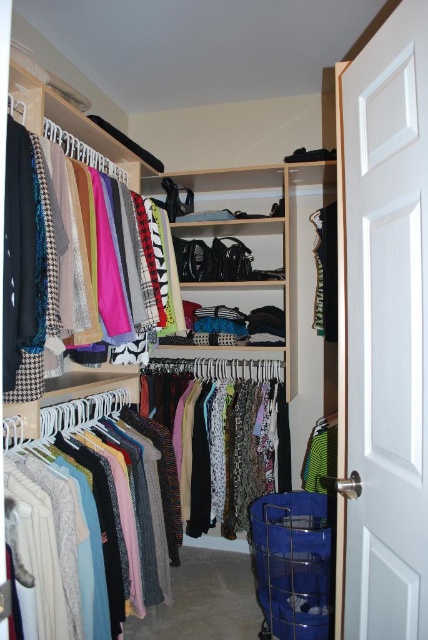
Is point (9, 300) closer to camera compared to point (324, 284)?

Yes, point (9, 300) is in front of point (324, 284).

Does matte black scarf at upper left appear on the left side of green jersey at center?

Correct, you'll find matte black scarf at upper left to the left of green jersey at center.

What do you see at coordinates (29, 266) in the screenshot?
I see `matte black scarf at upper left` at bounding box center [29, 266].

What are the coordinates of `matte black scarf at upper left` in the screenshot? It's located at (29, 266).

Does matte wooden closet at center have a lesser height compared to green jersey at center?

No, matte wooden closet at center is not shorter than green jersey at center.

Is point (288, 253) closer to camera compared to point (315, 225)?

Yes, point (288, 253) is in front of point (315, 225).

The image size is (428, 640). I want to click on matte wooden closet at center, so click(269, 218).

The width and height of the screenshot is (428, 640). What do you see at coordinates (59, 541) in the screenshot?
I see `knitwear at left` at bounding box center [59, 541].

Consider the image. Between knitwear at left and green jersey at center, which one has less height?

green jersey at center is shorter.

The image size is (428, 640). I want to click on knitwear at left, so click(x=59, y=541).

Where is `knitwear at left`? This screenshot has height=640, width=428. knitwear at left is located at coordinates (59, 541).